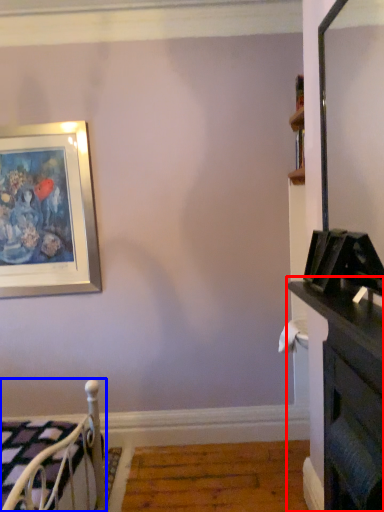
Question: Among these objects, which one is nearest to the camera, dresser (highlighted by a red box) or furniture (highlighted by a blue box)?

Choices:
 (A) dresser
 (B) furniture

Answer: (A)